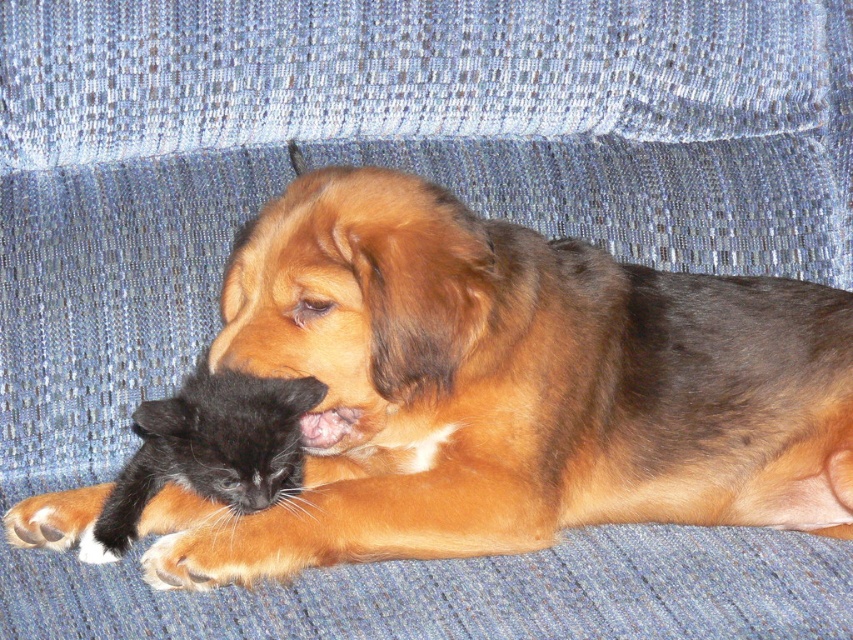
Question: Is brown fur dog at center bigger than black fur/kitten at lower left?

Choices:
 (A) no
 (B) yes

Answer: (B)

Question: Is brown fur dog at center thinner than black fur/kitten at lower left?

Choices:
 (A) no
 (B) yes

Answer: (A)

Question: Which point is farther to the camera?

Choices:
 (A) brown fur dog at center
 (B) black fur/kitten at lower left

Answer: (B)

Question: Which point appears closest to the camera in this image?

Choices:
 (A) (850, 502)
 (B) (135, 458)

Answer: (B)

Question: Can you confirm if brown fur dog at center is thinner than black fur/kitten at lower left?

Choices:
 (A) yes
 (B) no

Answer: (B)